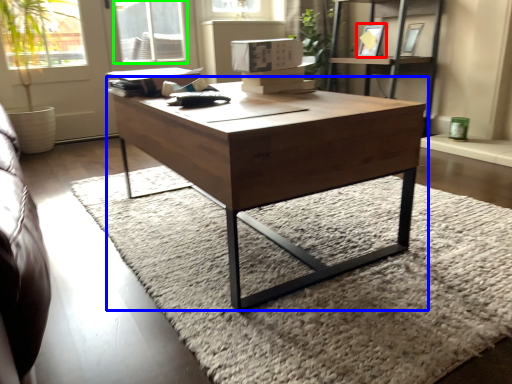
Question: Which object is the closest to the picture frame (highlighted by a red box)? Choose among these: coffee table (highlighted by a blue box) or window (highlighted by a green box).

Choices:
 (A) coffee table
 (B) window

Answer: (B)